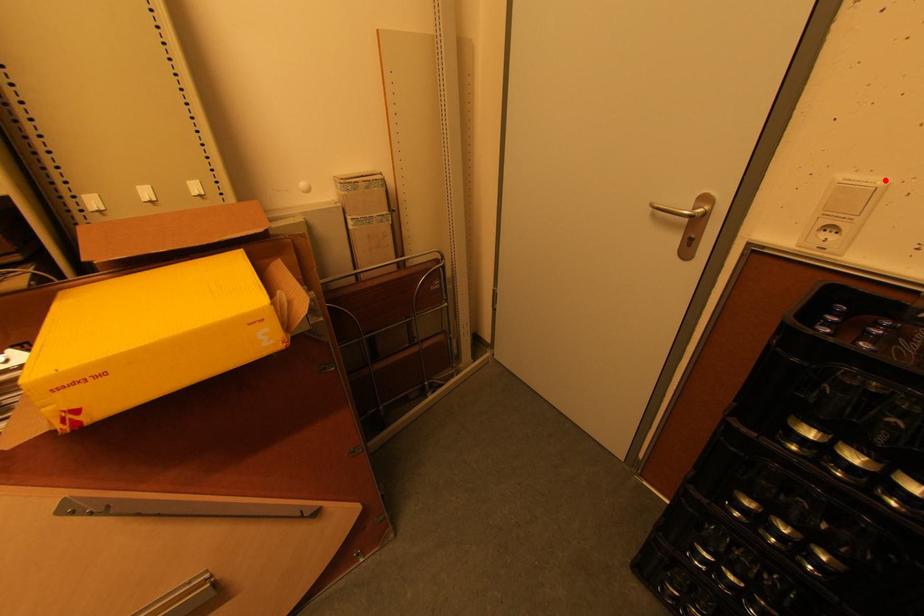
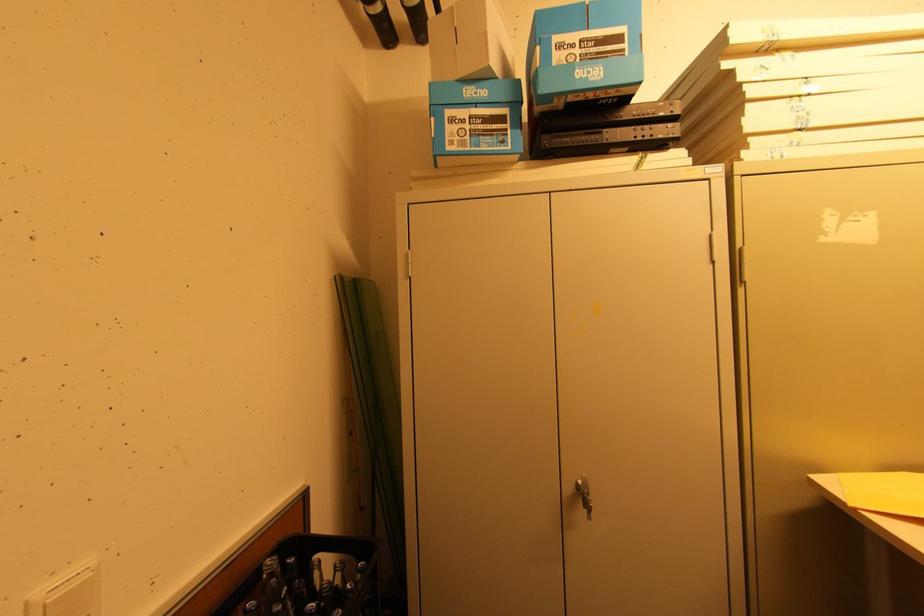
Question: I am providing you with two images of the same scene from different viewpoints. Given a red point in image1, look at the same physical point in image2. Is it:

Choices:
 (A) Closer to the viewpoint
 (B) Farther from the viewpoint

Answer: (A)